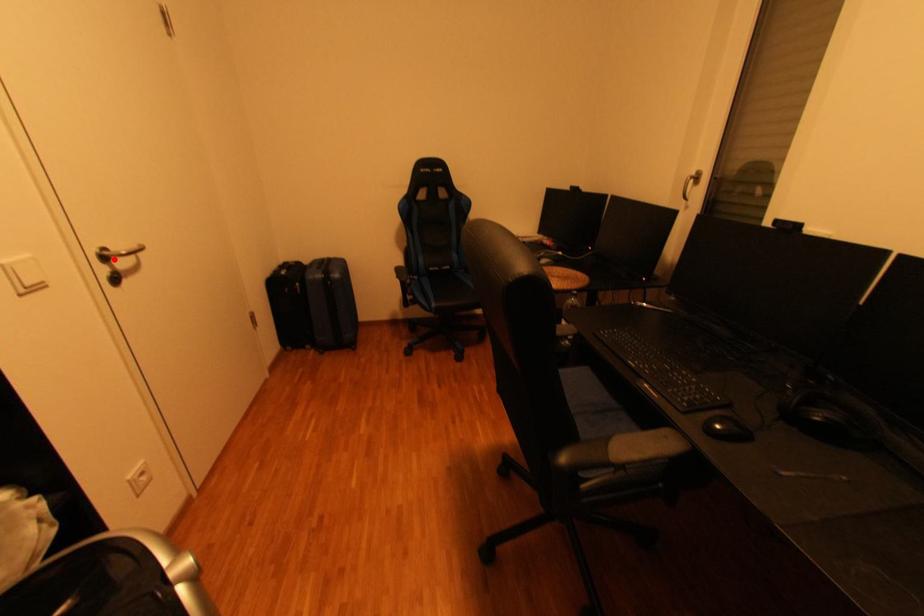
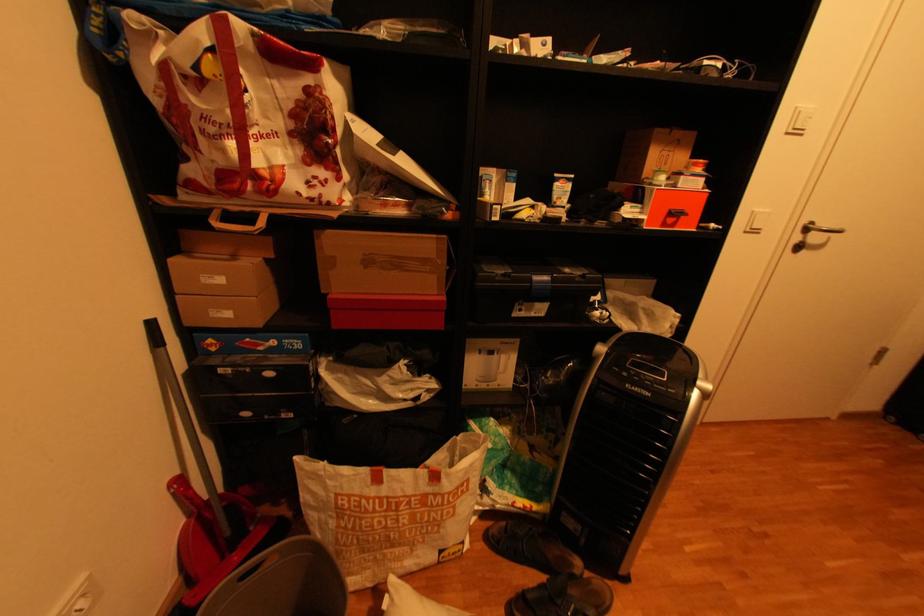
Where in the second image is the point corresponding to the highlighted location from the first image?

(816, 230)